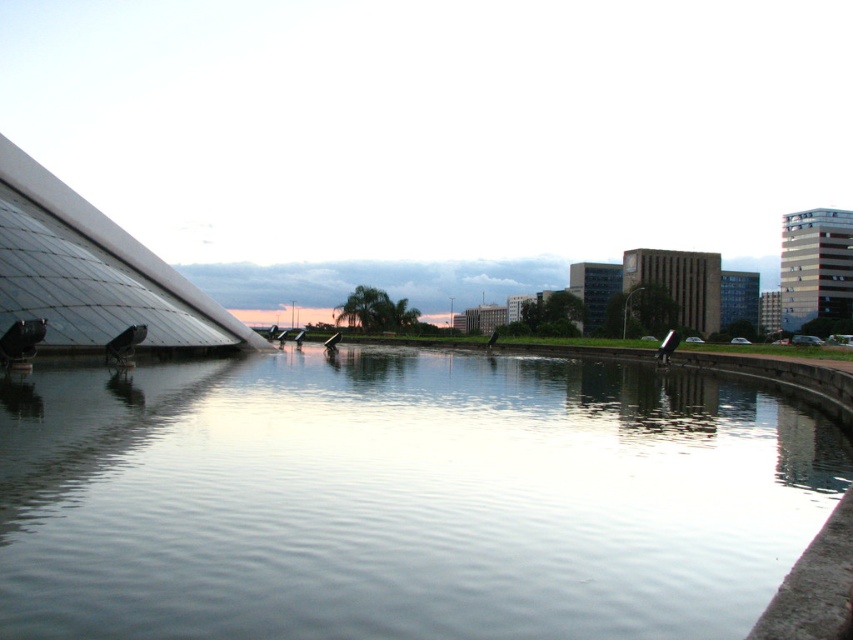
Question: Which point is farther from the camera taking this photo?

Choices:
 (A) (711, 404)
 (B) (74, 248)

Answer: (B)

Question: Where is clear water at center located in relation to transparent glass pyramid at upper left in the image?

Choices:
 (A) below
 (B) above

Answer: (A)

Question: Does clear water at center have a smaller size compared to transparent glass pyramid at upper left?

Choices:
 (A) yes
 (B) no

Answer: (A)

Question: Which point is closer to the camera?

Choices:
 (A) (149, 339)
 (B) (463, 492)

Answer: (B)

Question: Among these objects, which one is nearest to the camera?

Choices:
 (A) transparent glass pyramid at upper left
 (B) clear water at center

Answer: (B)

Question: Can you confirm if clear water at center is positioned to the left of transparent glass pyramid at upper left?

Choices:
 (A) yes
 (B) no

Answer: (B)